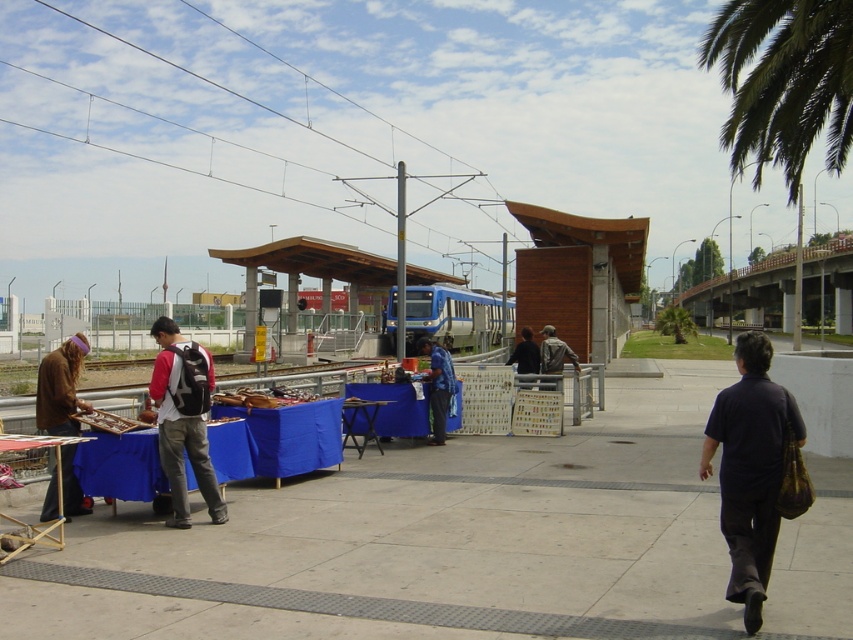
You are standing at the train station platform and see the matte black backpack at center and the blue metallic train at center. The train is about to depart. Can you quickly grab the backpack and run to the train before it leaves? Assume you can run at 5 meters per second and the train will depart in 10 seconds.

The matte black backpack at center is 40.08 meters away from the blue metallic train at center. To cover this distance at 5 meters per second would take 8.016 seconds, which is less than the 10 seconds before departure. Therefore, you can grab the backpack and reach the train before it leaves.